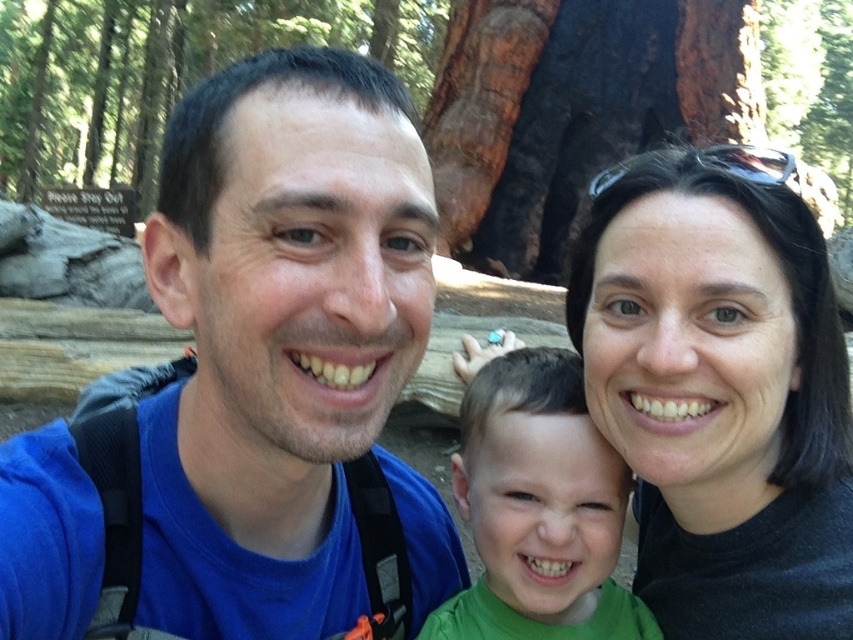
Can you confirm if black matte hair at upper right is positioned below green matte shirt at center?

No.

Is black matte hair at upper right above green matte shirt at center?

Yes.

Locate an element on the screen. This screenshot has width=853, height=640. black matte hair at upper right is located at coordinates (720, 397).

Is blue fabric shirt at center above green matte shirt at center?

Correct, blue fabric shirt at center is located above green matte shirt at center.

Can you confirm if blue fabric shirt at center is smaller than green matte shirt at center?

Correct, blue fabric shirt at center occupies less space than green matte shirt at center.

Image resolution: width=853 pixels, height=640 pixels. Describe the element at coordinates (277, 337) in the screenshot. I see `blue fabric shirt at center` at that location.

This screenshot has height=640, width=853. In order to click on blue fabric shirt at center in this screenshot , I will do `click(277, 337)`.

Who is shorter, blue fabric shirt at center or black matte hair at upper right?

With less height is blue fabric shirt at center.

Is point (212, 177) closer to camera compared to point (752, 236)?

Yes, point (212, 177) is in front of point (752, 236).

This screenshot has height=640, width=853. What do you see at coordinates (277, 337) in the screenshot?
I see `blue fabric shirt at center` at bounding box center [277, 337].

Identify the location of blue fabric shirt at center. This screenshot has width=853, height=640. (277, 337).